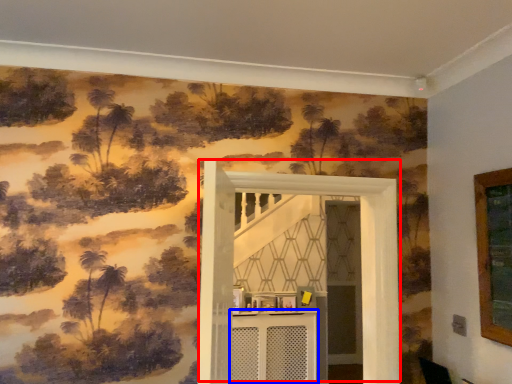
Question: Which of the following is the closest to the observer, door (highlighted by a red box) or table (highlighted by a blue box)?

Choices:
 (A) door
 (B) table

Answer: (A)